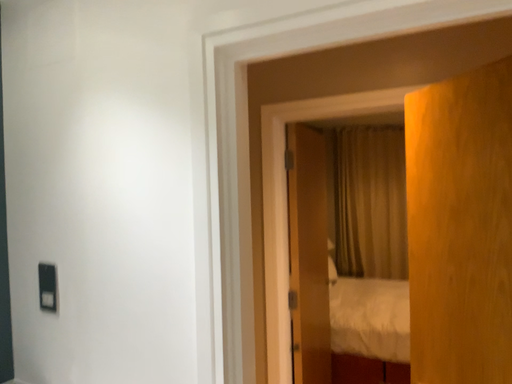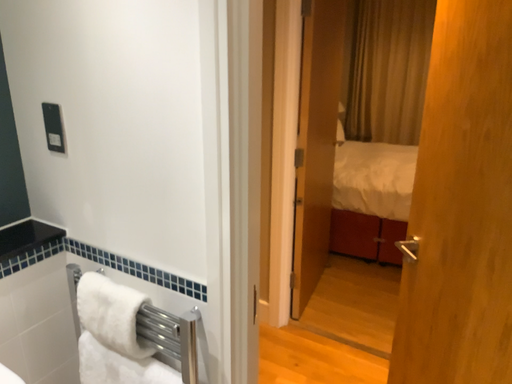
Question: How did the camera likely rotate when shooting the video?

Choices:
 (A) rotated downward
 (B) rotated upward

Answer: (A)